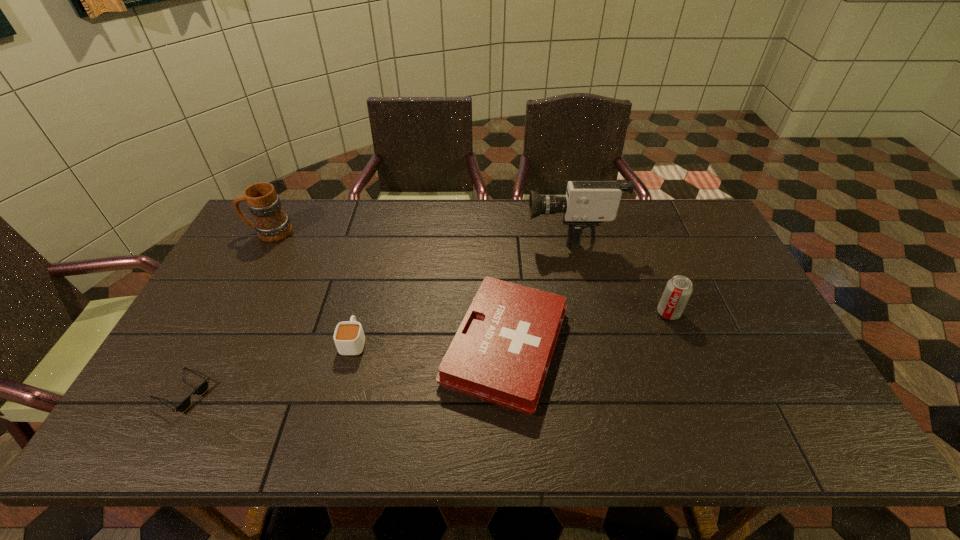
Find the location of a particular element. object that is the fifth closest to the shortest object is located at coordinates (678, 290).

Identify the location of object that is the third closest one to the third tallest object. (349, 338).

Identify the location of free spot that satisfies the following two spatial constraints: 1. on the side of the fifth shortest object with the handle; 2. on the left side of the rightmost object. (227, 313).

Where is `vacant point that satisfies the following two spatial constraints: 1. on the side of the second tallest object with the handle; 2. on the left side of the first-aid kit`? vacant point that satisfies the following two spatial constraints: 1. on the side of the second tallest object with the handle; 2. on the left side of the first-aid kit is located at coordinates (208, 347).

Image resolution: width=960 pixels, height=540 pixels. I want to click on free space that satisfies the following two spatial constraints: 1. on the side of the first-aid kit with the handle; 2. on the right side of the mug, so click(208, 347).

You are a GUI agent. You are given a task and a screenshot of the screen. Output one action in this format:
    pyautogui.click(x=<x>, y=<y>)
    Task: Click on the free point that satisfies the following two spatial constraints: 1. on the side of the second tallest object with the handle; 2. on the left side of the first-aid kit
    The width and height of the screenshot is (960, 540).
    Given the screenshot: What is the action you would take?
    [208, 347]

The width and height of the screenshot is (960, 540). Identify the location of free location that satisfies the following two spatial constraints: 1. on the front side of the rightmost object; 2. on the lenses of the sunglasses. (700, 393).

The image size is (960, 540). I want to click on free space that satisfies the following two spatial constraints: 1. on the side of the fifth shortest object with the handle; 2. on the side with the handle of the third object from left to right, so click(x=211, y=341).